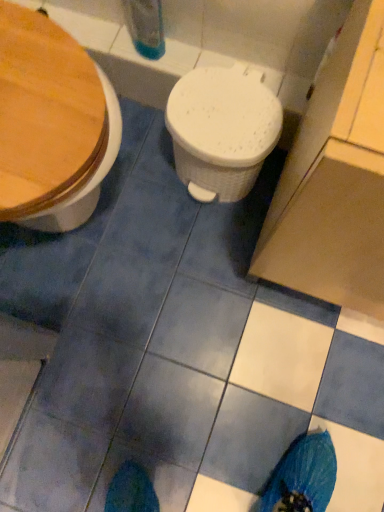
Question: Considering the positions of wooden at left, which appears as the second toilet when viewed from the right, and white textured plastic at center, which ranks as the 2th toilet in left-to-right order, in the image, is wooden at left, which appears as the second toilet when viewed from the right, wider or thinner than white textured plastic at center, which ranks as the 2th toilet in left-to-right order,?

Choices:
 (A) wide
 (B) thin

Answer: (A)

Question: Is wooden at left, positioned as the 1th toilet in left-to-right order, in front of or behind white textured plastic at center, placed as the first toilet when sorted from right to left, in the image?

Choices:
 (A) front
 (B) behind

Answer: (A)

Question: Is point (89, 71) closer or farther from the camera than point (210, 92)?

Choices:
 (A) closer
 (B) farther

Answer: (A)

Question: Is white textured plastic at center, placed as the first toilet when sorted from right to left, situated inside wooden at left, which appears as the second toilet when viewed from the right, or outside?

Choices:
 (A) outside
 (B) inside

Answer: (A)

Question: Looking at the image, does white textured plastic at center, which ranks as the 2th toilet in left-to-right order, seem bigger or smaller compared to wooden at left, positioned as the 1th toilet in left-to-right order?

Choices:
 (A) small
 (B) big

Answer: (A)

Question: From their relative heights in the image, would you say white textured plastic at center, placed as the first toilet when sorted from right to left, is taller or shorter than wooden at left, which appears as the second toilet when viewed from the right?

Choices:
 (A) short
 (B) tall

Answer: (A)

Question: Visually, is white textured plastic at center, which ranks as the 2th toilet in left-to-right order, positioned to the left or to the right of wooden at left, positioned as the 1th toilet in left-to-right order?

Choices:
 (A) left
 (B) right

Answer: (B)